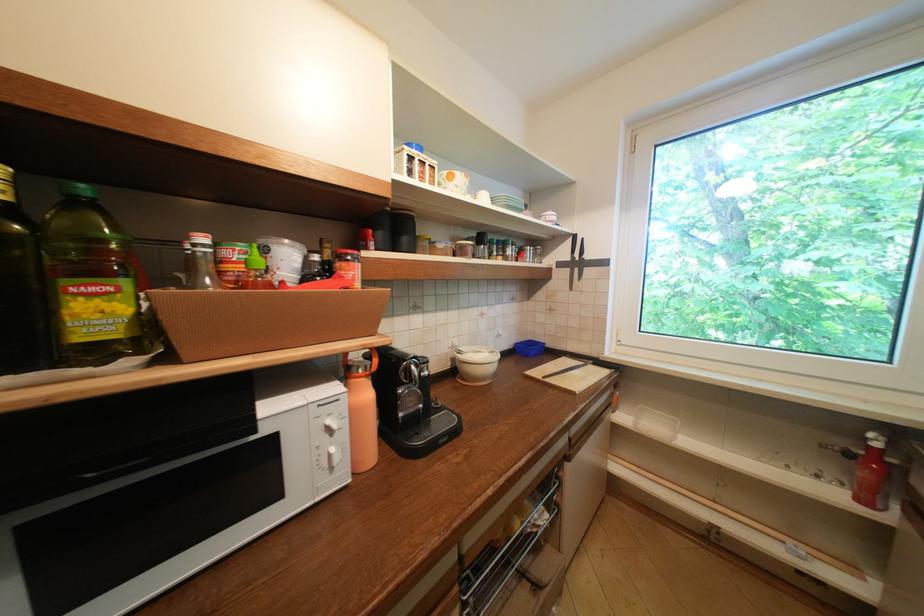
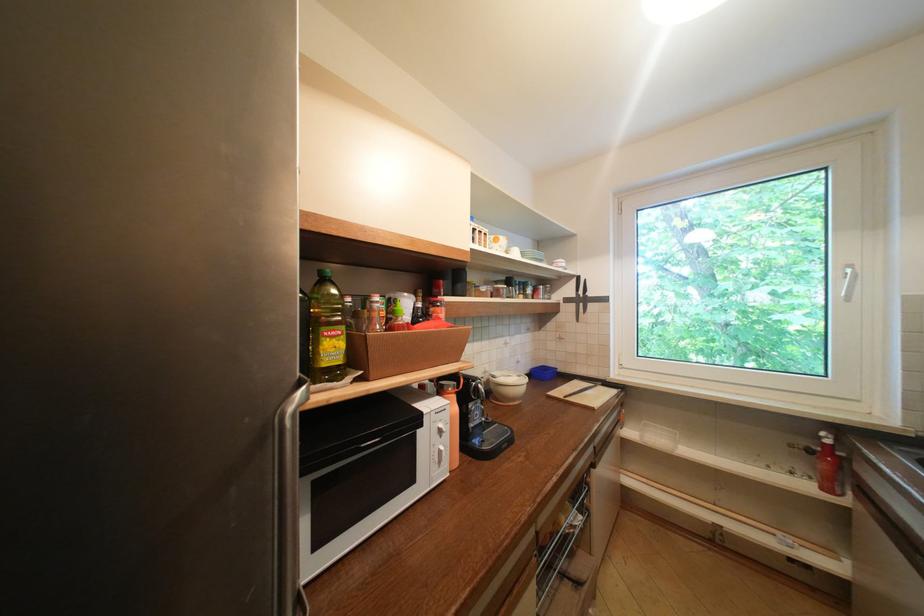
In the second image, find the point that corresponds to the point at 337,456 in the first image.

(448, 454)